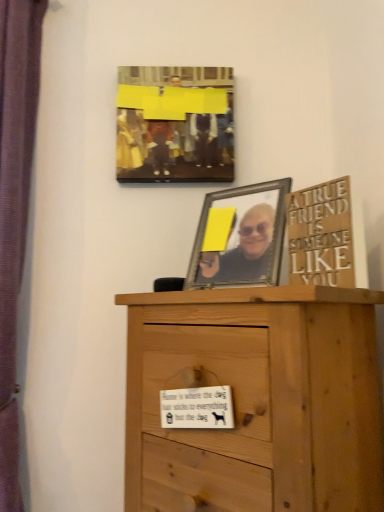
Question: Is matte yellow canvas at upper center to the right of light brown wood chest of drawers at center from the viewer's perspective?

Choices:
 (A) no
 (B) yes

Answer: (A)

Question: From a real-world perspective, is matte yellow canvas at upper center positioned under light brown wood chest of drawers at center based on gravity?

Choices:
 (A) yes
 (B) no

Answer: (B)

Question: Would you say light brown wood chest of drawers at center is part of matte yellow canvas at upper center's contents?

Choices:
 (A) yes
 (B) no

Answer: (B)

Question: From the image's perspective, does matte yellow canvas at upper center appear lower than light brown wood chest of drawers at center?

Choices:
 (A) no
 (B) yes

Answer: (A)

Question: Is matte yellow canvas at upper center positioned far away from light brown wood chest of drawers at center?

Choices:
 (A) no
 (B) yes

Answer: (A)

Question: In terms of height, does wooden sign at upper right look taller or shorter compared to light brown wood chest of drawers at center?

Choices:
 (A) tall
 (B) short

Answer: (B)

Question: Based on their sizes in the image, would you say wooden sign at upper right is bigger or smaller than light brown wood chest of drawers at center?

Choices:
 (A) big
 (B) small

Answer: (B)

Question: Is wooden sign at upper right wider or thinner than light brown wood chest of drawers at center?

Choices:
 (A) thin
 (B) wide

Answer: (A)

Question: From the image's perspective, is wooden sign at upper right located above or below light brown wood chest of drawers at center?

Choices:
 (A) below
 (B) above

Answer: (B)

Question: From a real-world perspective, is light brown wood chest of drawers at center above or below wooden sign at upper right?

Choices:
 (A) below
 (B) above

Answer: (A)

Question: Which is correct: light brown wood chest of drawers at center is inside wooden sign at upper right, or outside of it?

Choices:
 (A) outside
 (B) inside

Answer: (A)

Question: Is light brown wood chest of drawers at center in front of or behind wooden sign at upper right in the image?

Choices:
 (A) behind
 (B) front

Answer: (B)

Question: Visually, is light brown wood chest of drawers at center positioned to the left or to the right of wooden sign at upper right?

Choices:
 (A) left
 (B) right

Answer: (A)

Question: Is wooden sign at upper right situated inside matte yellow canvas at upper center or outside?

Choices:
 (A) inside
 (B) outside

Answer: (B)

Question: From a real-world perspective, relative to matte yellow canvas at upper center, is wooden sign at upper right vertically above or below?

Choices:
 (A) above
 (B) below

Answer: (B)